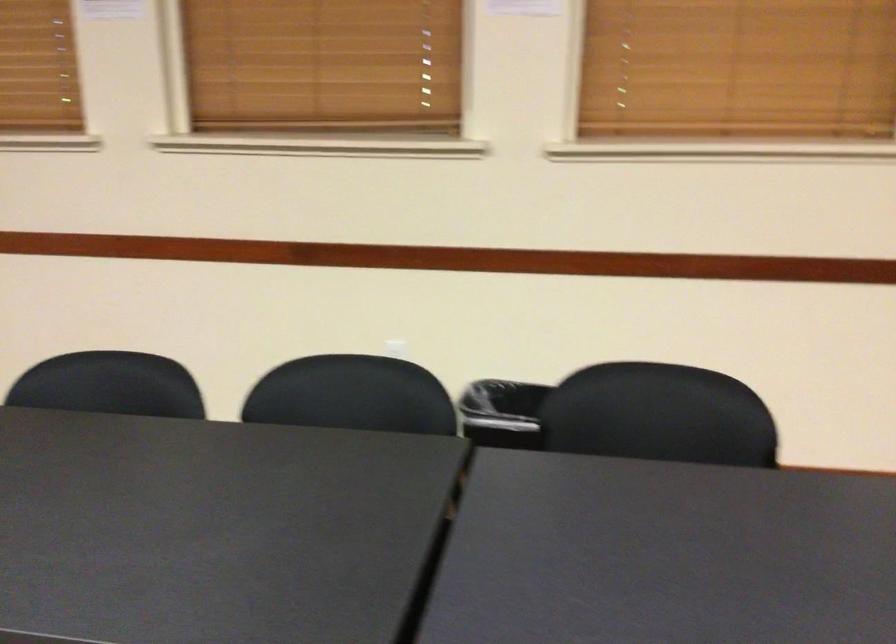
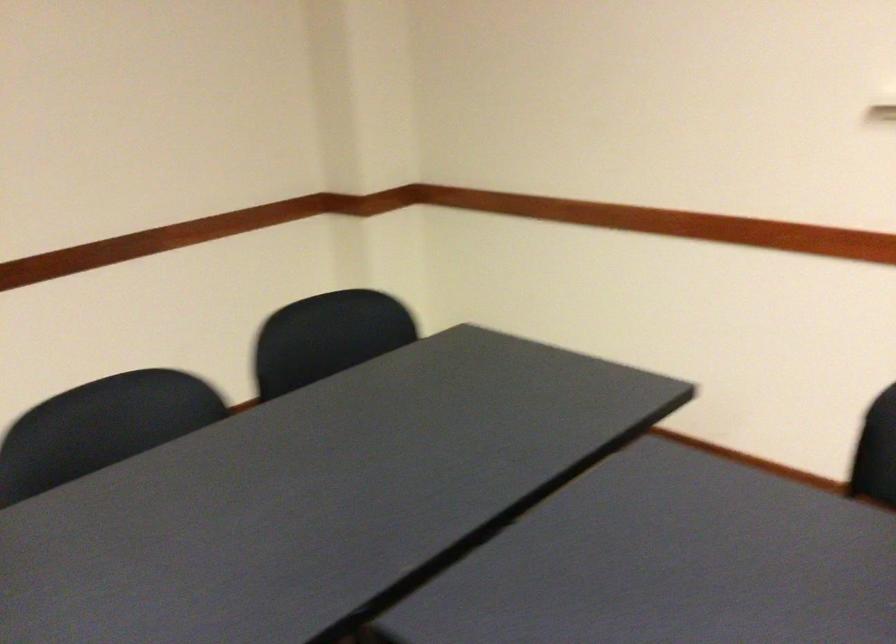
Question: How did the camera likely rotate?

Choices:
 (A) Left
 (B) Right
 (C) Up
 (D) Down

Answer: (B)